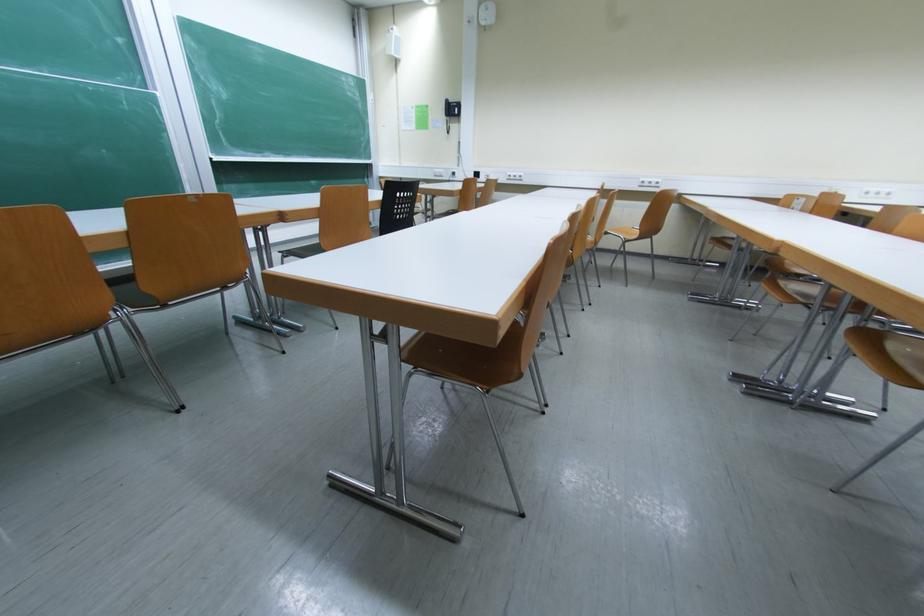
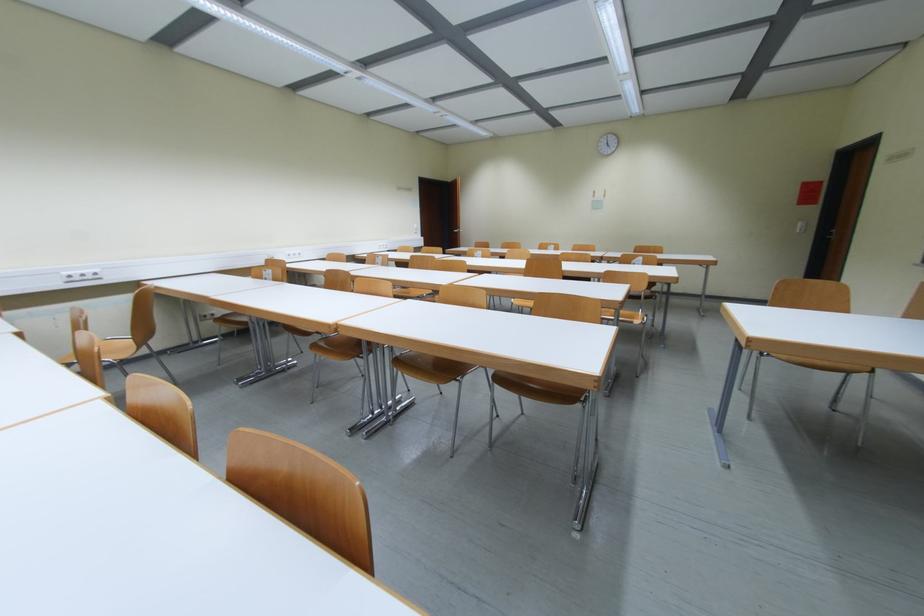
Question: The images are taken continuously from a first-person perspective. In which direction is your viewpoint rotating?

Choices:
 (A) Left
 (B) Right
 (C) Up
 (D) Down

Answer: (B)